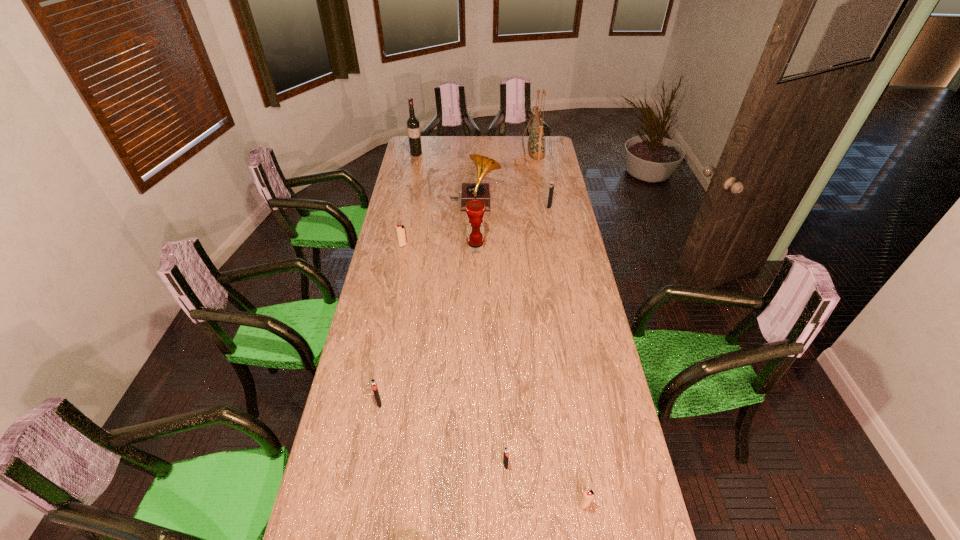
Find the location of a particular element. Image resolution: width=960 pixels, height=540 pixels. the left red igniter is located at coordinates (400, 229).

The image size is (960, 540). In order to click on the second farthest igniter in this screenshot , I will do `click(400, 229)`.

Where is `the right red igniter`? The image size is (960, 540). the right red igniter is located at coordinates (588, 495).

The height and width of the screenshot is (540, 960). What are the coordinates of `the fourth igniter from left to right` in the screenshot? It's located at (588, 495).

In order to click on the third igniter from left to right in this screenshot , I will do (x=506, y=453).

Where is `the second black igniter from left to right`? The height and width of the screenshot is (540, 960). the second black igniter from left to right is located at coordinates (506, 453).

Find the location of a particular element. This screenshot has width=960, height=540. vacant space located on the front-facing side of the handbag is located at coordinates (489, 150).

At what (x,y) coordinates should I click in order to perform the action: click on blank space located on the front-facing side of the handbag. Please return your answer as a coordinate pair (x, y). This screenshot has width=960, height=540. Looking at the image, I should click on (501, 150).

The width and height of the screenshot is (960, 540). In order to click on vacant region located on the front-facing side of the handbag in this screenshot , I will do `click(464, 150)`.

Find the location of a particular element. The width and height of the screenshot is (960, 540). vacant space situated 0.200m on the front and back of the wine bottle is located at coordinates 412,174.